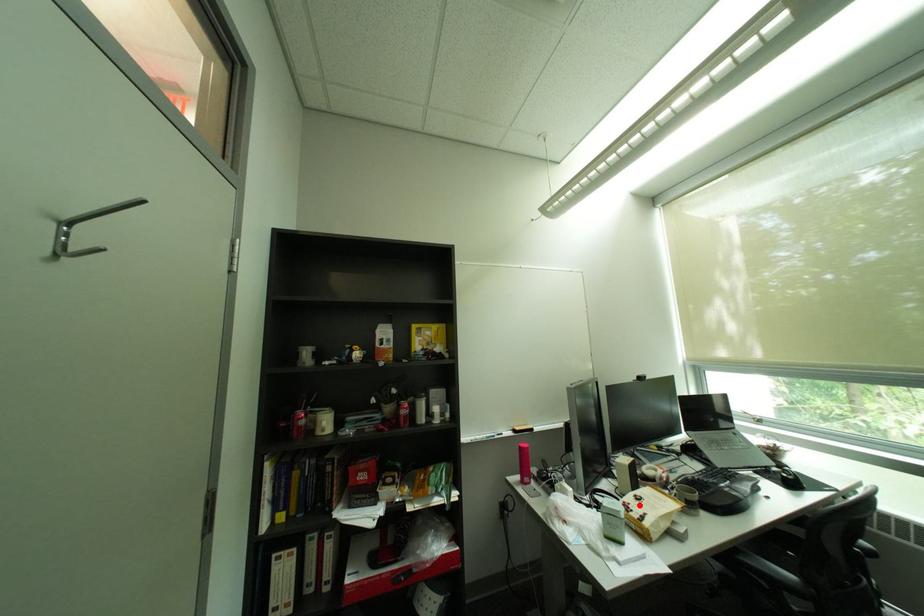
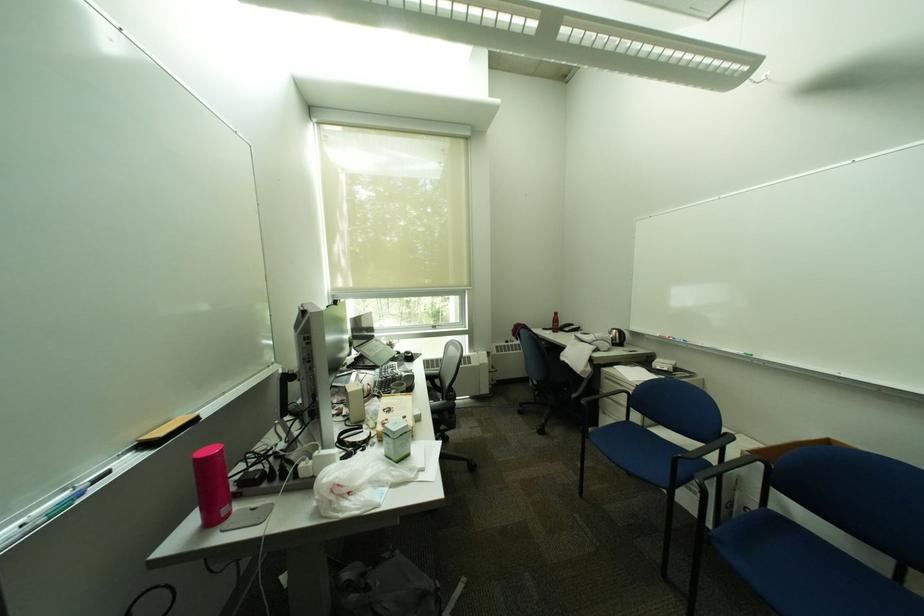
The point at the highlighted location is marked in the first image. Where is the corresponding point in the second image?

(397, 421)